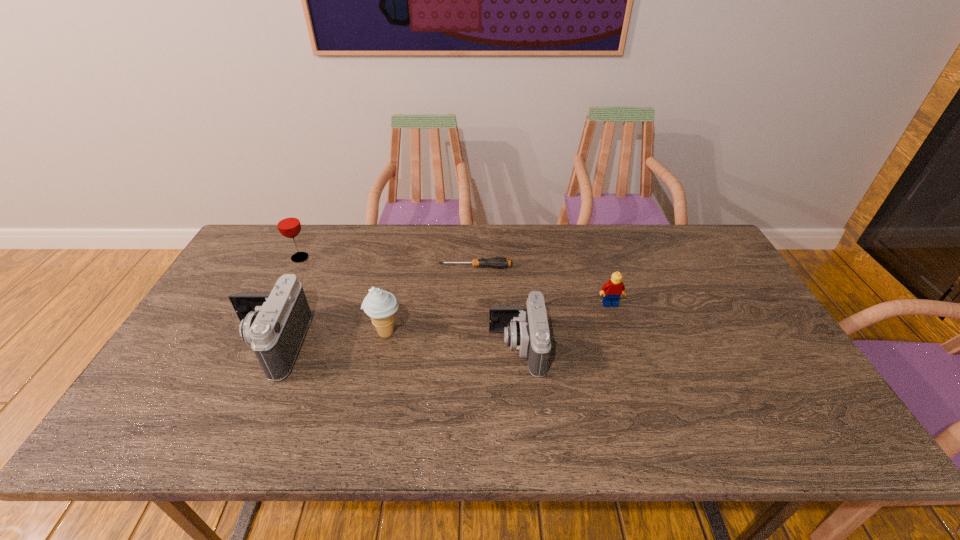
Where is `free space located at the front of the right camera with an open lens cover`? The height and width of the screenshot is (540, 960). free space located at the front of the right camera with an open lens cover is located at coordinates (348, 348).

The image size is (960, 540). Identify the location of vacant area situated 0.120m on the left of the glass. (252, 258).

The height and width of the screenshot is (540, 960). I want to click on free region located 0.160m on the front of the screwdriver, so click(x=475, y=307).

The height and width of the screenshot is (540, 960). I want to click on free location located on the left of the third object from left to right, so click(x=231, y=333).

You are a GUI agent. You are given a task and a screenshot of the screen. Output one action in this format:
    pyautogui.click(x=<x>, y=<y>)
    Task: Click on the blank area located 0.170m on the front-facing side of the rightmost object
    Image resolution: width=960 pixels, height=540 pixels.
    Given the screenshot: What is the action you would take?
    pyautogui.click(x=626, y=354)

Locate an element on the screen. The width and height of the screenshot is (960, 540). glass at the far edge is located at coordinates (288, 223).

At what (x,y) coordinates should I click in order to perform the action: click on screwdriver that is positioned at the far edge. Please return your answer as a coordinate pair (x, y). The image size is (960, 540). Looking at the image, I should click on (496, 262).

Identify the location of object located at the left edge. (274, 324).

Identify the location of object that is at the near left corner. (274, 324).

In order to click on vacant space at the far edge of the desktop in this screenshot , I will do `click(390, 245)`.